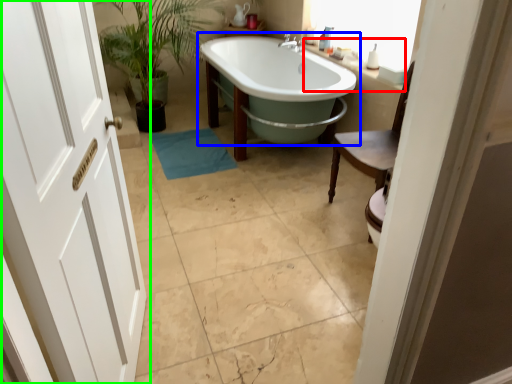
Question: Which is farther away from counter top (highlighted by a red box)? bathtub (highlighted by a blue box) or door (highlighted by a green box)?

Choices:
 (A) bathtub
 (B) door

Answer: (B)